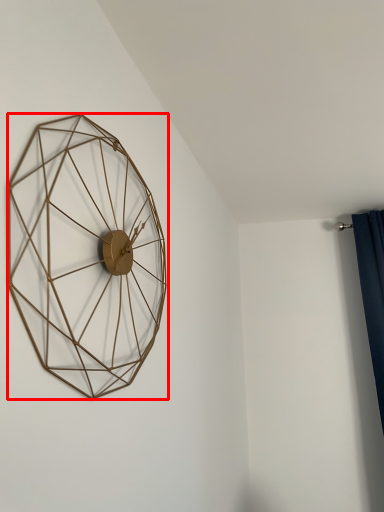
Question: In this image, where is wall clock (annotated by the red box) located relative to curtain?

Choices:
 (A) right
 (B) left

Answer: (B)